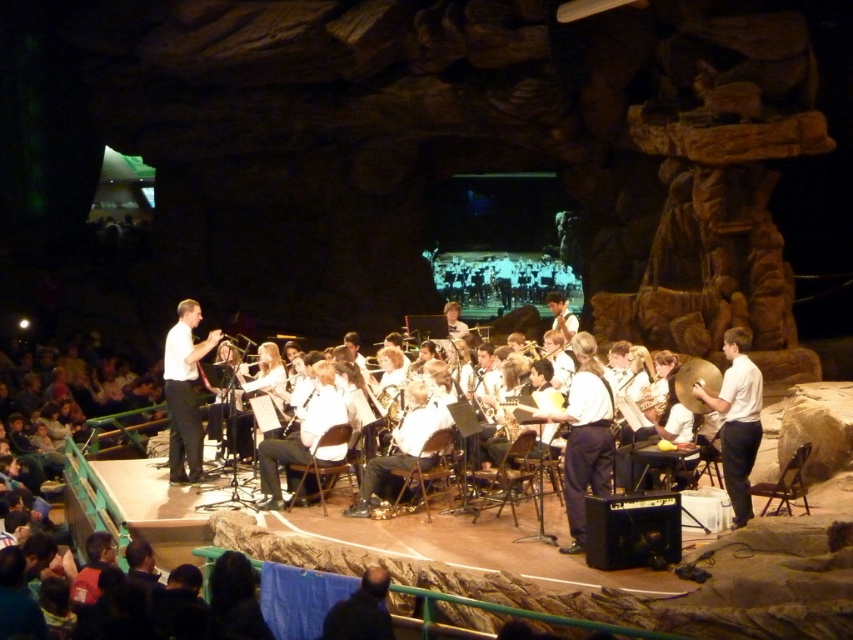
You are a stagehand preparing to place a new spotlight. The shiny silver cymbal at center is crucial for the performance. Where should you aim the spotlight based on its coordinates?

The shiny silver cymbal at center should be illuminated by aiming the spotlight at its coordinates located at point (695, 384).

You are a photographer taking a photo of the band members. You notice the white smooth shirt at center and the metallic silver clarinet at center. Which object should you focus on if you want to capture the taller one in the scene?

The white smooth shirt at center is taller than the metallic silver clarinet at center, so you should focus on the white smooth shirt at center to capture the taller object.

You are a photographer in the audience of this performance. You want to capture a photo where both the white smooth shirt at center and the gold metallic trumpet at center are clearly visible. Based on their positions, will the trumpet be visible in front of or behind the white shirt in the photo?

The gold metallic trumpet at center is behind the white smooth shirt at center, so in the photo, the trumpet will be visible behind the white shirt.